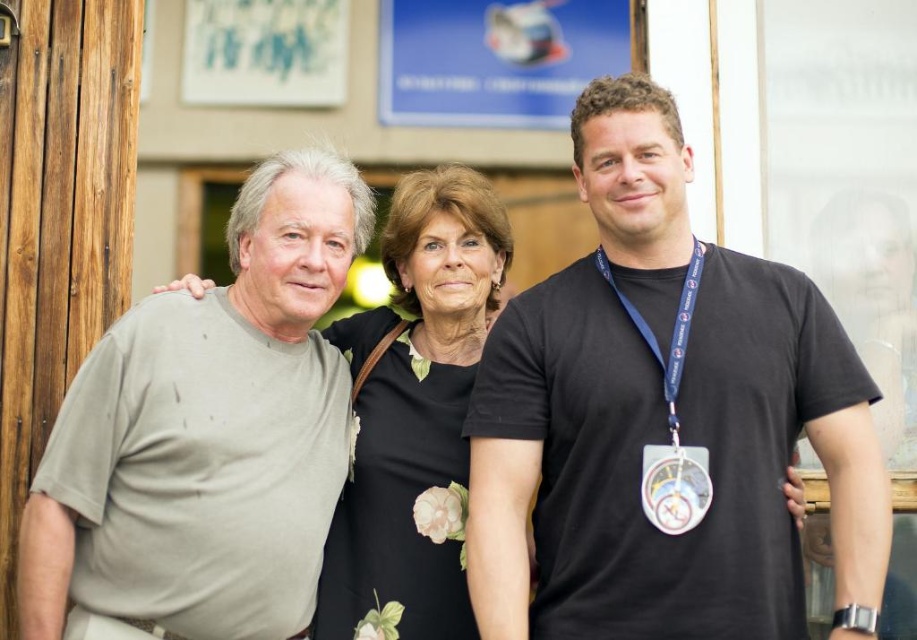
Question: Which is farther from the metallic circular badge at center-right?

Choices:
 (A) black floral dress at center
 (B) black matte t-shirt at right

Answer: (A)

Question: Which of the following is the farthest from the observer?

Choices:
 (A) matte khaki t-shirt at left
 (B) black floral dress at center
 (C) black matte t-shirt at right

Answer: (B)

Question: Observing the image, what is the correct spatial positioning of black matte t-shirt at right in reference to black floral dress at center?

Choices:
 (A) left
 (B) right

Answer: (B)

Question: Which object appears farthest from the camera in this image?

Choices:
 (A) black matte t-shirt at right
 (B) black floral dress at center
 (C) metallic circular badge at center-right

Answer: (B)

Question: Is black matte t-shirt at right above matte khaki t-shirt at left?

Choices:
 (A) no
 (B) yes

Answer: (B)

Question: In this image, where is black matte t-shirt at right located relative to black floral dress at center?

Choices:
 (A) above
 (B) below

Answer: (B)